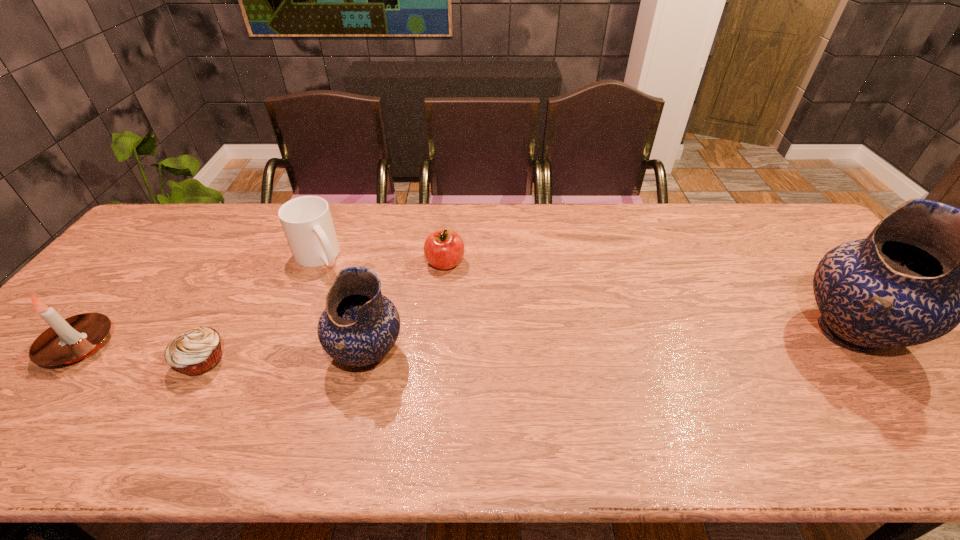
To make them evenly spaced by inserting another pottery among them, please locate a free space for this new pottery. Please provide its 2D coordinates. Your answer should be formatted as a tuple, i.e. [(x, y)], where the tuple contains the x and y coordinates of a point satisfying the conditions above.

[(613, 343)]